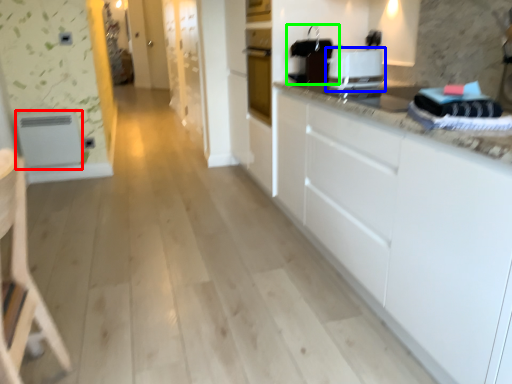
Question: Considering the real-world distances, which object is closest to appliance (highlighted by a red box)? home appliance (highlighted by a blue box) or appliance (highlighted by a green box).

Choices:
 (A) home appliance
 (B) appliance

Answer: (B)